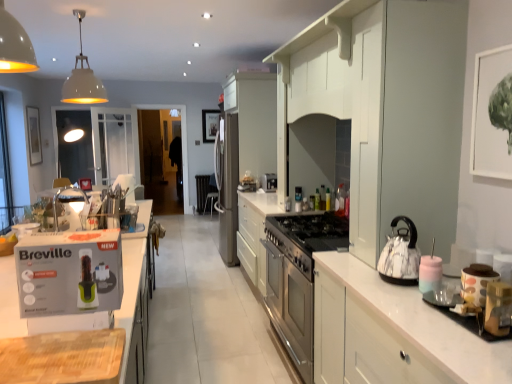
Question: Can you confirm if white glossy cabinet at center, acting as the 1th cabinetry starting from the back, is smaller than white cardboard box at left?

Choices:
 (A) yes
 (B) no

Answer: (B)

Question: Can you confirm if white glossy cabinet at center, acting as the 1th cabinetry starting from the back, is taller than white cardboard box at left?

Choices:
 (A) no
 (B) yes

Answer: (B)

Question: Does white glossy cabinet at center, positioned as the fourth cabinetry in front-to-back order, have a greater width compared to white cardboard box at left?

Choices:
 (A) no
 (B) yes

Answer: (B)

Question: Can you confirm if white glossy cabinet at center, acting as the 1th cabinetry starting from the back, is thinner than white cardboard box at left?

Choices:
 (A) no
 (B) yes

Answer: (A)

Question: Is white glossy cabinet at center, acting as the 1th cabinetry starting from the back, beside white cardboard box at left?

Choices:
 (A) no
 (B) yes

Answer: (A)

Question: Is white cardboard box at left surrounded by white glossy cabinet at center, positioned as the fourth cabinetry in front-to-back order?

Choices:
 (A) yes
 (B) no

Answer: (B)

Question: Does transparent glass screen door at center touch black matte picture frame at upper center, the 1th picture frame when ordered from back to front?

Choices:
 (A) yes
 (B) no

Answer: (B)

Question: Is transparent glass screen door at center looking in the opposite direction of black matte picture frame at upper center, the 1th picture frame when ordered from right to left?

Choices:
 (A) no
 (B) yes

Answer: (A)

Question: Is transparent glass screen door at center closer to camera compared to black matte picture frame at upper center, which appears as the 2th picture frame when viewed from the left?

Choices:
 (A) yes
 (B) no

Answer: (A)

Question: Is transparent glass screen door at center far from black matte picture frame at upper center, which appears as the 2th picture frame when viewed from the left?

Choices:
 (A) yes
 (B) no

Answer: (B)

Question: Is the depth of transparent glass screen door at center greater than that of black matte picture frame at upper center, the 1th picture frame when ordered from back to front?

Choices:
 (A) yes
 (B) no

Answer: (B)

Question: Can you confirm if transparent glass screen door at center is taller than black matte picture frame at upper center, which ranks as the 2th picture frame in front-to-back order?

Choices:
 (A) no
 (B) yes

Answer: (B)

Question: Can you confirm if white glossy cabinet at right, the first cabinetry in the front-to-back sequence, is wider than polka dot ceramic jar at right, the first appliance when ordered from back to front?

Choices:
 (A) yes
 (B) no

Answer: (A)